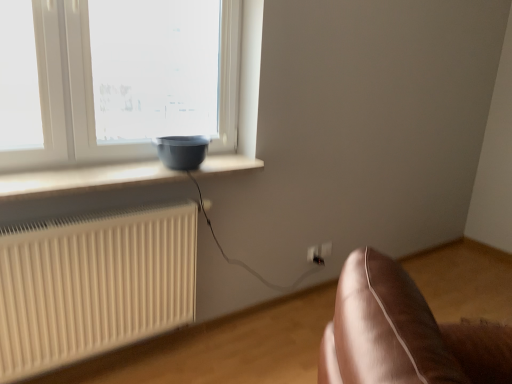
Question: Is white plastic electric outlet at lower right, the 1th electric outlet positioned from the front, positioned far away from matte gray bowl at window?

Choices:
 (A) yes
 (B) no

Answer: (A)

Question: Could you tell me if white plastic electric outlet at lower right, marked as the second electric outlet in a right-to-left arrangement, is facing matte gray bowl at window?

Choices:
 (A) no
 (B) yes

Answer: (A)

Question: Would you say white plastic electric outlet at lower right, which is the 1th electric outlet in left-to-right order, contains matte gray bowl at window?

Choices:
 (A) yes
 (B) no

Answer: (B)

Question: Is white plastic electric outlet at lower right, which is the 1th electric outlet in left-to-right order, next to matte gray bowl at window?

Choices:
 (A) no
 (B) yes

Answer: (A)

Question: Can you confirm if white plastic electric outlet at lower right, marked as the second electric outlet in a back-to-front arrangement, is thinner than matte gray bowl at window?

Choices:
 (A) yes
 (B) no

Answer: (A)

Question: From the image's perspective, is white plastic electric outlet at lower right, the 1th electric outlet positioned from the front, on matte gray bowl at window?

Choices:
 (A) yes
 (B) no

Answer: (B)

Question: Is there a large distance between white plastic electric outlet at lower right, marked as the second electric outlet in a back-to-front arrangement, and white ribbed radiator at lower left?

Choices:
 (A) yes
 (B) no

Answer: (A)

Question: Is white plastic electric outlet at lower right, which is the 1th electric outlet in left-to-right order, further to the viewer compared to white ribbed radiator at lower left?

Choices:
 (A) yes
 (B) no

Answer: (A)

Question: Are white plastic electric outlet at lower right, marked as the second electric outlet in a right-to-left arrangement, and white ribbed radiator at lower left beside each other?

Choices:
 (A) no
 (B) yes

Answer: (A)

Question: Is white plastic electric outlet at lower right, which is the 1th electric outlet in left-to-right order, oriented away from white ribbed radiator at lower left?

Choices:
 (A) yes
 (B) no

Answer: (B)

Question: Is white plastic electric outlet at lower right, which is the 1th electric outlet in left-to-right order, taller than white ribbed radiator at lower left?

Choices:
 (A) no
 (B) yes

Answer: (A)

Question: From the image's perspective, is white plastic electric outlet at lower right, the 1th electric outlet positioned from the front, below white ribbed radiator at lower left?

Choices:
 (A) yes
 (B) no

Answer: (B)

Question: Is matte gray bowl at window outside white ribbed radiator at lower left?

Choices:
 (A) yes
 (B) no

Answer: (A)